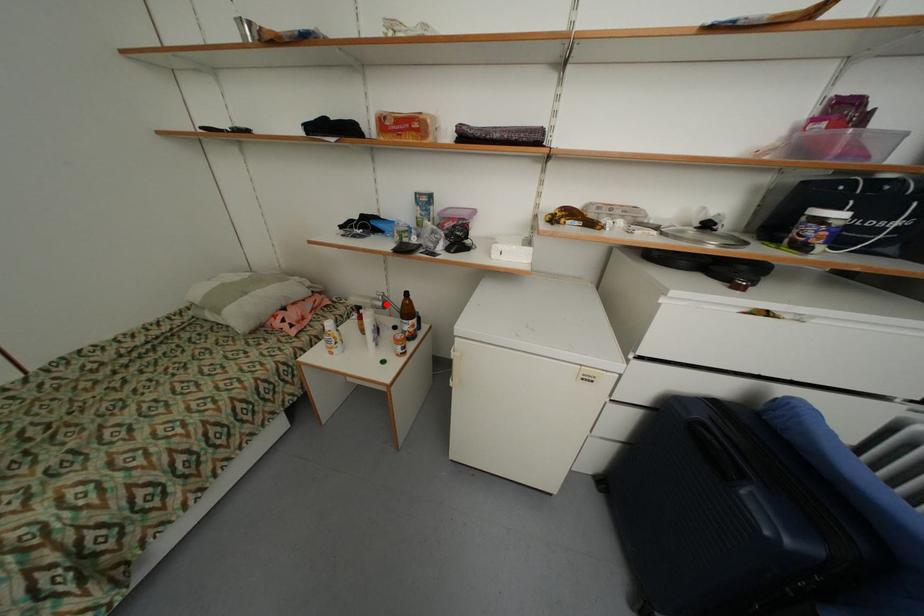
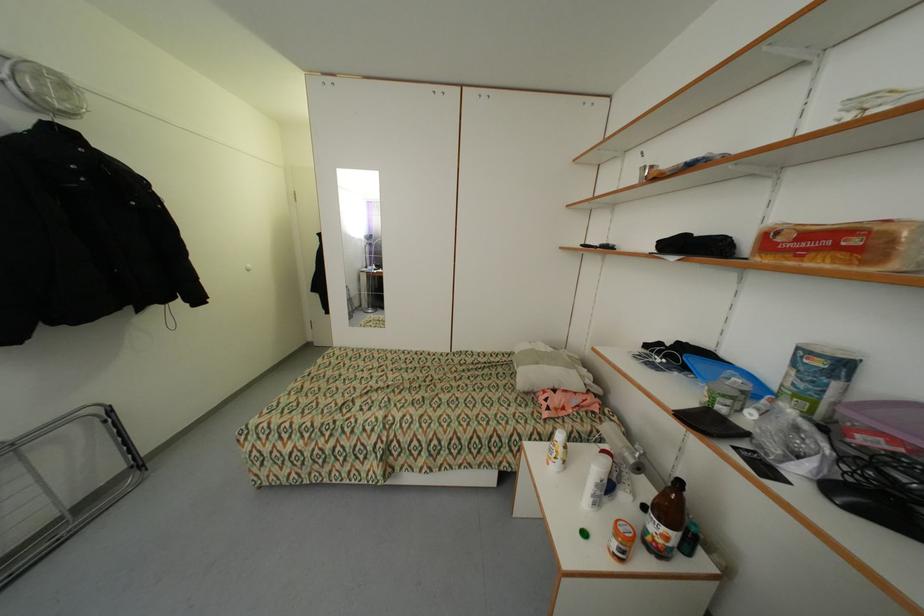
Question: I am providing you with two images of the same scene from different viewpoints. In image1, a red point is highlighted. Considering the same 3D point in image2, which of the following is correct?

Choices:
 (A) It is closer
 (B) It is farther

Answer: (A)